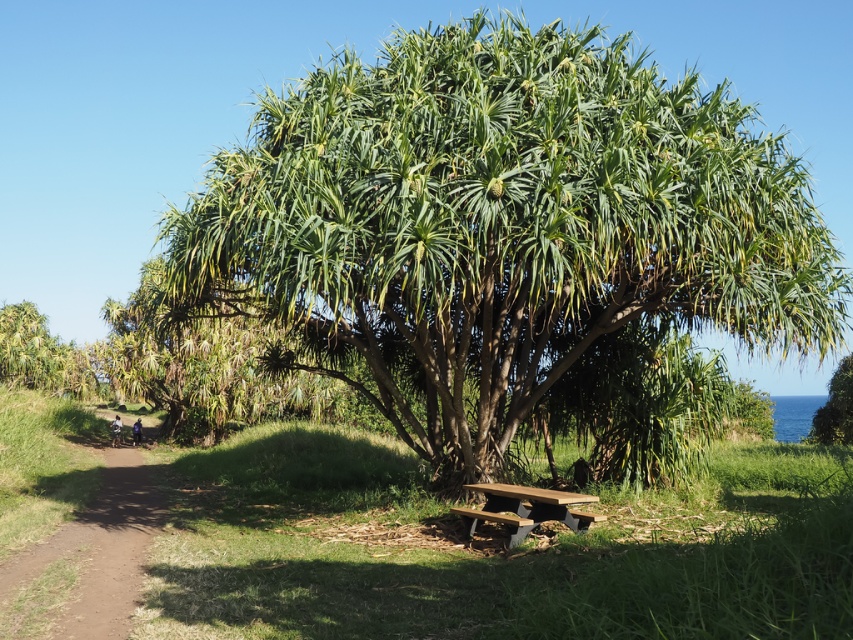
Who is shorter, brown dirt path at lower left or brown wooden picnic table at lower center?

With less height is brown wooden picnic table at lower center.

Locate an element on the screen. brown dirt path at lower left is located at coordinates (x=86, y=557).

Can you confirm if brown wooden picnic table at lower center is smaller than green leafy tree at right?

Yes, brown wooden picnic table at lower center is smaller than green leafy tree at right.

Image resolution: width=853 pixels, height=640 pixels. I want to click on brown wooden picnic table at lower center, so click(x=525, y=509).

Where is `brown wooden picnic table at lower center`? brown wooden picnic table at lower center is located at coordinates (525, 509).

Does green leafy tree at center lie behind green leafy tree at right?

No, it is in front of green leafy tree at right.

Which of these two, green leafy tree at center or green leafy tree at right, stands taller?

With more height is green leafy tree at center.

Identify the location of green leafy tree at center. This screenshot has height=640, width=853. (498, 227).